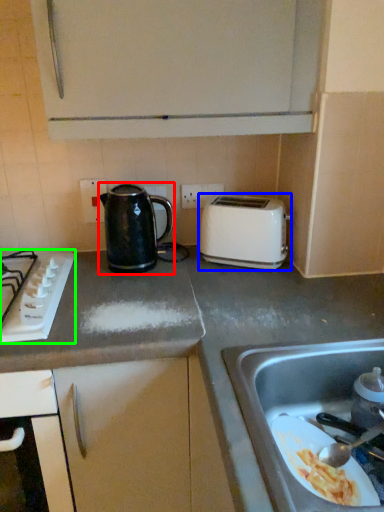
Question: Which is farther away from kettle (highlighted by a red box)? toaster (highlighted by a blue box) or gas stove (highlighted by a green box)?

Choices:
 (A) toaster
 (B) gas stove

Answer: (A)